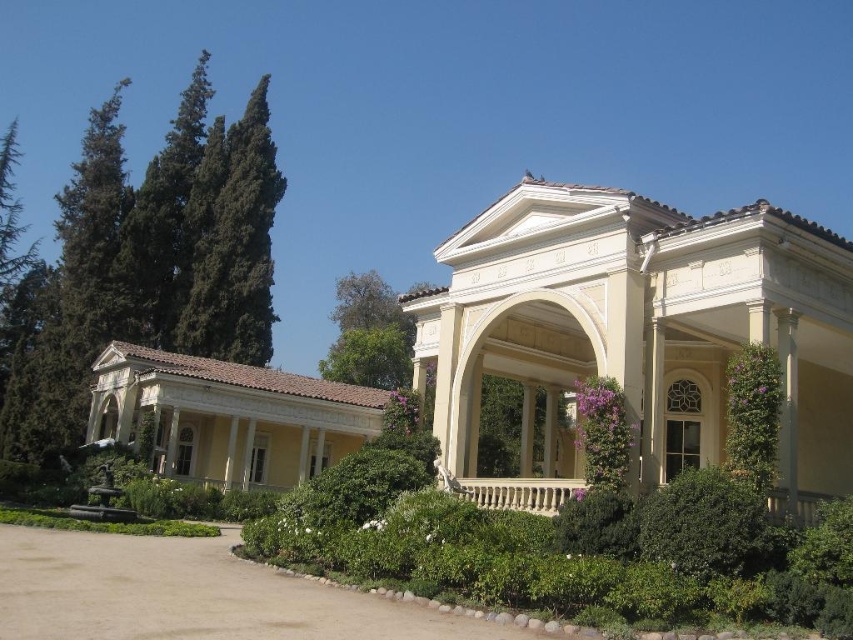
You are standing at the entrance of the beige stucco pavilion at center. Where would you look to find the main entrance of the building?

The main entrance of the building is located at the portico with large columns, which is part of the beige stucco pavilion at center as described in the scene.

You are standing in front of the classical building and want to take a photo. There are two points marked on the building, point (x=277, y=604) and point (x=786, y=490). Which point should you focus on first if you want to capture the closest part of the building in your photo?

Point (x=277, y=604) is closer to the camera than point (x=786, y=490), so you should focus on point (x=277, y=604) first to capture the closest part of the building in your photo.